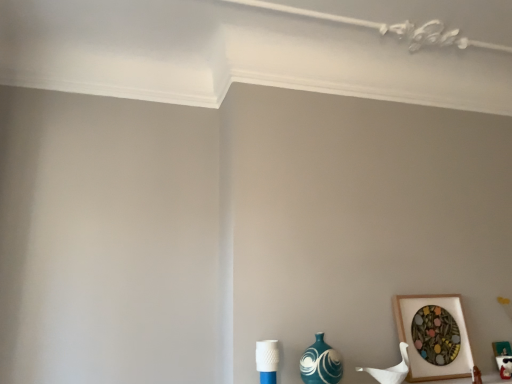
Image resolution: width=512 pixels, height=384 pixels. What do you see at coordinates (415, 347) in the screenshot? I see `wooden picture frame at lower right` at bounding box center [415, 347].

Identify the location of wooden picture frame at lower right. (415, 347).

This screenshot has height=384, width=512. Describe the element at coordinates (321, 363) in the screenshot. I see `teal glossy vase at lower right` at that location.

Where is `teal glossy vase at lower right`? teal glossy vase at lower right is located at coordinates (321, 363).

Where is `wooden picture frame at lower right`? This screenshot has height=384, width=512. wooden picture frame at lower right is located at coordinates (415, 347).

Considering the relative positions of wooden picture frame at lower right and teal glossy vase at lower right in the image provided, is wooden picture frame at lower right to the left of teal glossy vase at lower right from the viewer's perspective?

Incorrect, wooden picture frame at lower right is not on the left side of teal glossy vase at lower right.

Is wooden picture frame at lower right closer to camera compared to teal glossy vase at lower right?

No.

Is point (443, 377) behind point (337, 360)?

That is True.

From the image's perspective, which one is positioned higher, wooden picture frame at lower right or teal glossy vase at lower right?

From the image's view, wooden picture frame at lower right is above.

From a real-world perspective, between wooden picture frame at lower right and teal glossy vase at lower right, who is vertically lower?

teal glossy vase at lower right is physically lower.

Is wooden picture frame at lower right thinner than teal glossy vase at lower right?

Correct, the width of wooden picture frame at lower right is less than that of teal glossy vase at lower right.

Which of these two, wooden picture frame at lower right or teal glossy vase at lower right, stands taller?

Standing taller between the two is wooden picture frame at lower right.

Looking at this image, considering the relative sizes of wooden picture frame at lower right and teal glossy vase at lower right in the image provided, is wooden picture frame at lower right bigger than teal glossy vase at lower right?

Indeed, wooden picture frame at lower right has a larger size compared to teal glossy vase at lower right.

Do you think wooden picture frame at lower right is within teal glossy vase at lower right, or outside of it?

wooden picture frame at lower right lies outside teal glossy vase at lower right.

Are wooden picture frame at lower right and teal glossy vase at lower right making contact?

No, wooden picture frame at lower right is not in contact with teal glossy vase at lower right.

Is teal glossy vase at lower right at the back of wooden picture frame at lower right?

wooden picture frame at lower right is not turned away from teal glossy vase at lower right.

Can you tell me how much wooden picture frame at lower right and teal glossy vase at lower right differ in facing direction?

The facing directions of wooden picture frame at lower right and teal glossy vase at lower right are 0.00642 degrees apart.

This screenshot has width=512, height=384. I want to click on picture frame on the right of the teal glossy vase at lower right, so click(x=415, y=347).

Is teal glossy vase at lower right to the right of wooden picture frame at lower right from the viewer's perspective?

In fact, teal glossy vase at lower right is to the left of wooden picture frame at lower right.

Does teal glossy vase at lower right lie behind wooden picture frame at lower right?

No.

Which point is more forward, (x=314, y=362) or (x=426, y=303)?

The point (x=314, y=362) is more forward.

From the image's perspective, which one is positioned higher, teal glossy vase at lower right or wooden picture frame at lower right?

wooden picture frame at lower right, from the image's perspective.

From a real-world perspective, does teal glossy vase at lower right stand above wooden picture frame at lower right?

No, from a real-world perspective, teal glossy vase at lower right is not on top of wooden picture frame at lower right.

Is teal glossy vase at lower right thinner than wooden picture frame at lower right?

No, teal glossy vase at lower right is not thinner than wooden picture frame at lower right.

Does teal glossy vase at lower right have a lesser height compared to wooden picture frame at lower right?

Indeed, teal glossy vase at lower right has a lesser height compared to wooden picture frame at lower right.

Considering the sizes of objects teal glossy vase at lower right and wooden picture frame at lower right in the image provided, who is smaller, teal glossy vase at lower right or wooden picture frame at lower right?

teal glossy vase at lower right.

Is teal glossy vase at lower right inside or outside of wooden picture frame at lower right?

teal glossy vase at lower right is outside wooden picture frame at lower right.

Is teal glossy vase at lower right far from wooden picture frame at lower right?

teal glossy vase at lower right is near wooden picture frame at lower right, not far away.

In the scene shown: Is teal glossy vase at lower right looking in the opposite direction of wooden picture frame at lower right?

No.

Identify the location of vase on the left of wooden picture frame at lower right. The image size is (512, 384). (321, 363).

At what (x,y) coordinates should I click in order to perform the action: click on picture frame located above the teal glossy vase at lower right (from the image's perspective). Please return your answer as a coordinate pair (x, y). The height and width of the screenshot is (384, 512). Looking at the image, I should click on (415, 347).

At what (x,y) coordinates should I click in order to perform the action: click on vase that appears in front of the wooden picture frame at lower right. Please return your answer as a coordinate pair (x, y). The image size is (512, 384). Looking at the image, I should click on (321, 363).